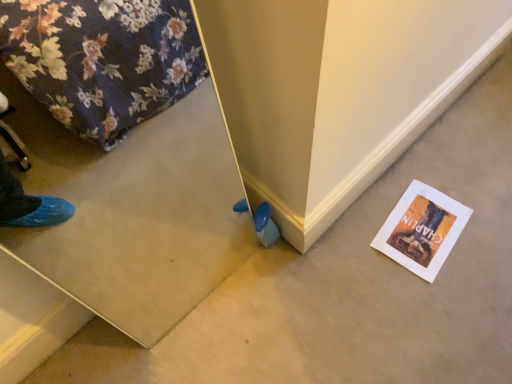
Where is `white paper at lower right`? white paper at lower right is located at coordinates (422, 229).

The width and height of the screenshot is (512, 384). Describe the element at coordinates (422, 229) in the screenshot. I see `white paper at lower right` at that location.

At what (x,y) coordinates should I click in order to perform the action: click on white paper at lower right. Please return your answer as a coordinate pair (x, y). Looking at the image, I should click on (422, 229).